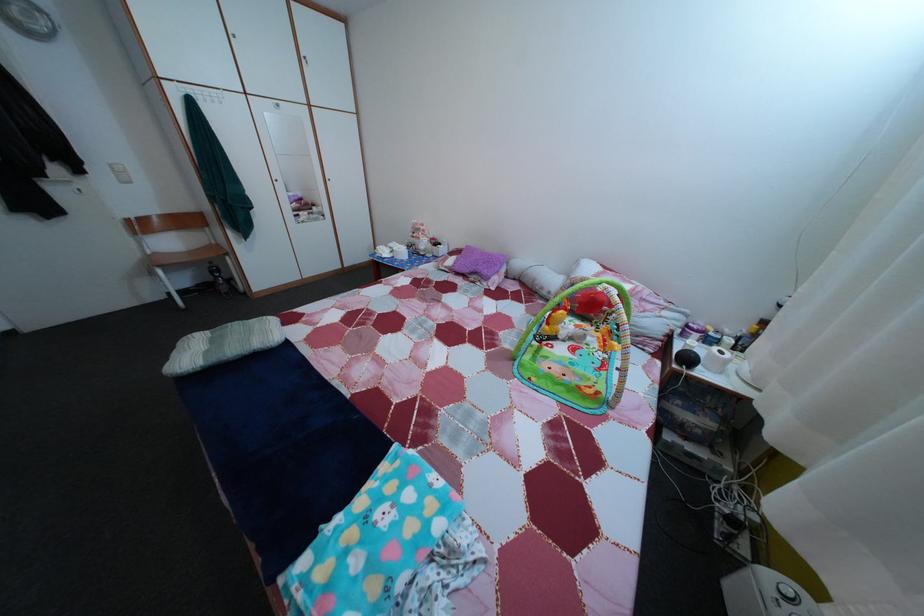
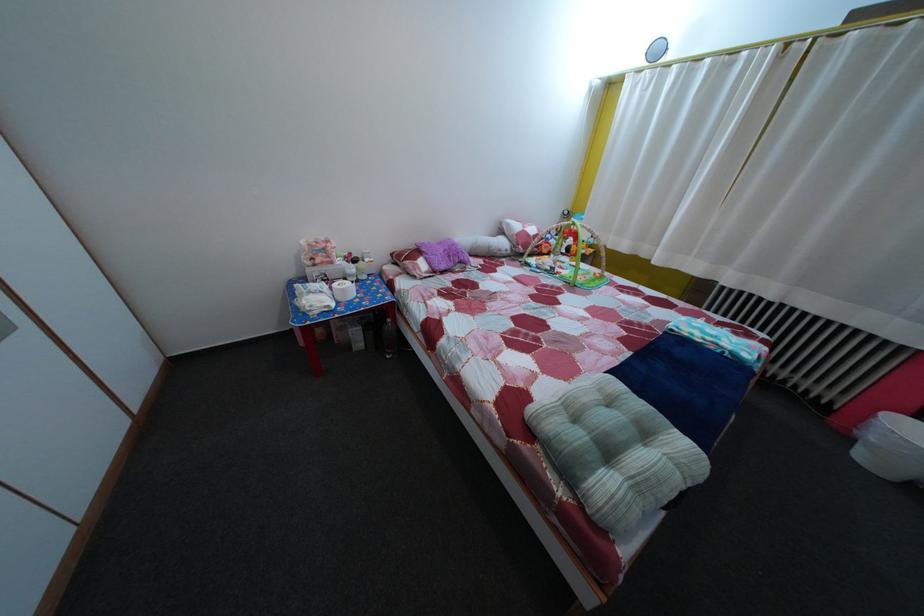
Find the pixel in the second image that matches the point at 492,261 in the first image.

(450, 252)